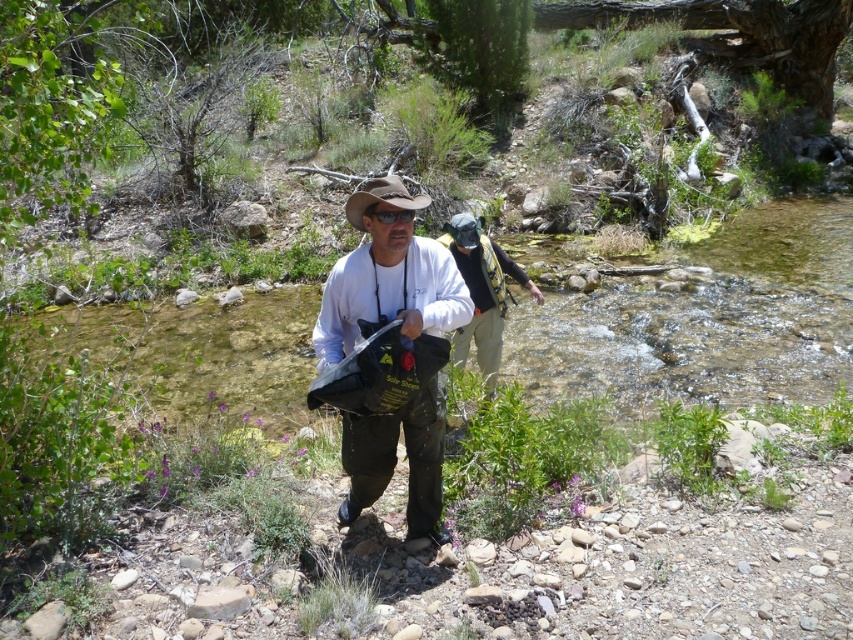
Between point (421, 524) and point (364, 205), which one is positioned in front?

Point (364, 205) is in front.

Is matte black bag at center below brown leather cowboy hat at center?

Yes, matte black bag at center is below brown leather cowboy hat at center.

Is point (350, 490) farther from camera compared to point (357, 195)?

Yes, it is.

Identify the location of matte black bag at center. This screenshot has width=853, height=640. tap(387, 275).

Image resolution: width=853 pixels, height=640 pixels. Describe the element at coordinates (482, 291) in the screenshot. I see `matte black backpack at center` at that location.

Is point (477, 291) positioned behind point (392, 202)?

Yes.

Find the location of a particular element. matte black backpack at center is located at coordinates (482, 291).

Between matte black bag at center and matte black backpack at center, which one is positioned higher?

matte black backpack at center is above.

The width and height of the screenshot is (853, 640). What do you see at coordinates (387, 275) in the screenshot? I see `matte black bag at center` at bounding box center [387, 275].

You are a GUI agent. You are given a task and a screenshot of the screen. Output one action in this format:
    pyautogui.click(x=<x>, y=<y>)
    Task: Click on the matte black bag at center
    The height and width of the screenshot is (640, 853).
    Given the screenshot: What is the action you would take?
    pyautogui.click(x=387, y=275)